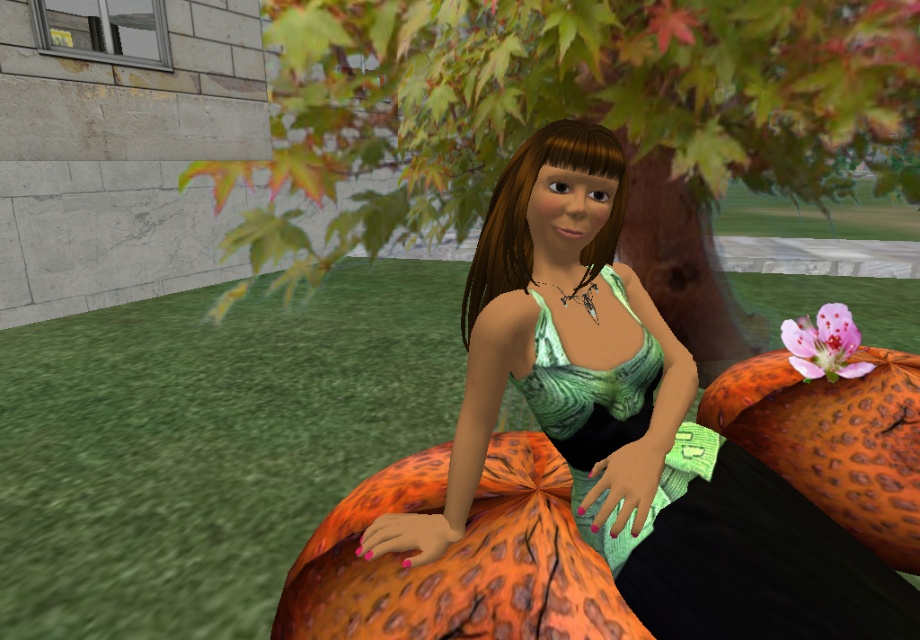
Consider the image. You are designing a garden layout and need to place a decorative pink matte flower at upper right and green grass at lower left. Given their widths, which area requires more space for planting?

The green grass at lower left requires more space for planting since its width surpasses that of the pink matte flower at upper right.

You are a character in the scene and want to step onto the green grass at lower left. What coordinates should you move to?

The green grass at lower left is located at coordinates point (207, 444), so move there.

You are standing in the image and want to reach the point marked at coordinates point (587, 118). Which object should you head towards?

The point (587, 118) is located on the green leafy tree at center, so you should head towards the green leafy tree at center to reach it.